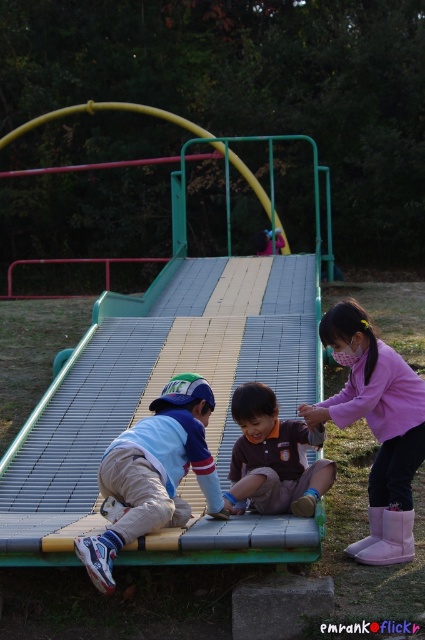
Question: Considering the real-world distances, which object is closest to the pink fabric mask at upper right?

Choices:
 (A) brown fabric shirt at center
 (B) light blue fabric shirt at center

Answer: (A)

Question: Does pink fabric mask at upper right appear on the right side of brown fabric shirt at center?

Choices:
 (A) yes
 (B) no

Answer: (A)

Question: Is pink fabric mask at upper right positioned in front of brown fabric shirt at center?

Choices:
 (A) yes
 (B) no

Answer: (B)

Question: Estimate the real-world distances between objects in this image. Which object is farther from the pink fabric mask at upper right?

Choices:
 (A) light blue fabric shirt at center
 (B) brown fabric shirt at center

Answer: (A)

Question: Considering the real-world distances, which object is farthest from the light blue fabric shirt at center?

Choices:
 (A) brown fabric shirt at center
 (B) pink fabric mask at upper right

Answer: (B)

Question: Does pink fabric mask at upper right appear on the left side of brown fabric shirt at center?

Choices:
 (A) yes
 (B) no

Answer: (B)